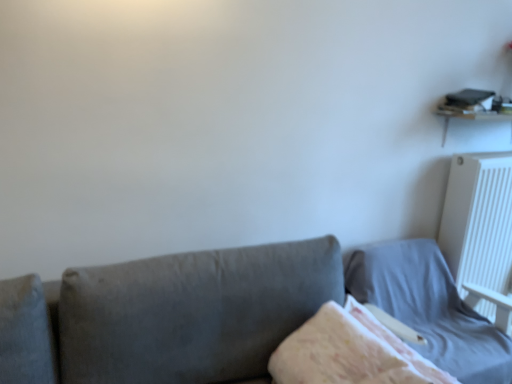
What do you see at coordinates (480, 232) in the screenshot? I see `white plastic radiator at upper right` at bounding box center [480, 232].

Identify the location of fluffy white blanket at center. The image size is (512, 384). (350, 351).

The image size is (512, 384). What do you see at coordinates (429, 307) in the screenshot? I see `light gray fabric bed at lower right` at bounding box center [429, 307].

Locate an element on the screen. This screenshot has height=384, width=512. white plastic radiator at upper right is located at coordinates (480, 232).

Considering the sizes of objects light gray fabric bed at lower right and white plastic radiator at upper right in the image provided, who is smaller, light gray fabric bed at lower right or white plastic radiator at upper right?

white plastic radiator at upper right is smaller.

Does light gray fabric bed at lower right have a lesser width compared to white plastic radiator at upper right?

No.

Which is behind, light gray fabric bed at lower right or white plastic radiator at upper right?

white plastic radiator at upper right is further from the camera.

Which object is thinner, light gray fabric bed at lower right or fluffy white blanket at center?

Thinner between the two is fluffy white blanket at center.

In the image, is light gray fabric bed at lower right on the left side or the right side of fluffy white blanket at center?

Based on their positions, light gray fabric bed at lower right is located to the right of fluffy white blanket at center.

Is light gray fabric bed at lower right positioned beyond the bounds of fluffy white blanket at center?

light gray fabric bed at lower right lies outside fluffy white blanket at center's area.

In the image, there is a light gray fabric bed at lower right. Where is `blanket above it (from the image's perspective)`? blanket above it (from the image's perspective) is located at coordinates (350, 351).

Considering the relative positions of white plastic radiator at upper right and fluffy white blanket at center in the image provided, is white plastic radiator at upper right to the left of fluffy white blanket at center from the viewer's perspective?

Incorrect, white plastic radiator at upper right is not on the left side of fluffy white blanket at center.

Is white plastic radiator at upper right turned away from fluffy white blanket at center?

white plastic radiator at upper right does not have its back to fluffy white blanket at center.

From the image's perspective, which object appears higher, white plastic radiator at upper right or fluffy white blanket at center?

white plastic radiator at upper right appears higher in the image.

Which is less distant, (x=497, y=289) or (x=341, y=326)?

Point (x=497, y=289).

From the picture: Could white plastic radiator at upper right be considered to be inside fluffy white blanket at center?

That's incorrect, white plastic radiator at upper right is not inside fluffy white blanket at center.

Is fluffy white blanket at center directly adjacent to white plastic radiator at upper right?

There is a gap between fluffy white blanket at center and white plastic radiator at upper right.

From a real-world perspective, is fluffy white blanket at center physically below white plastic radiator at upper right?

Yes, from a real-world perspective, fluffy white blanket at center is under white plastic radiator at upper right.

Is fluffy white blanket at center closer to the viewer compared to white plastic radiator at upper right?

That is True.

Is fluffy white blanket at center not within light gray fabric bed at lower right?

Yes, fluffy white blanket at center is located beyond the bounds of light gray fabric bed at lower right.

Which object is further away from the camera, fluffy white blanket at center or light gray fabric bed at lower right?

light gray fabric bed at lower right.

Who is taller, fluffy white blanket at center or light gray fabric bed at lower right?

Standing taller between the two is light gray fabric bed at lower right.

In the scene shown: Can you confirm if fluffy white blanket at center is positioned to the right of light gray fabric bed at lower right?

No, fluffy white blanket at center is not to the right of light gray fabric bed at lower right.

Which of these two, white plastic radiator at upper right or light gray fabric bed at lower right, is wider?

Wider between the two is light gray fabric bed at lower right.

Is white plastic radiator at upper right far away from light gray fabric bed at lower right?

They are positioned close to each other.

Considering the sizes of white plastic radiator at upper right and light gray fabric bed at lower right in the image, is white plastic radiator at upper right bigger or smaller than light gray fabric bed at lower right?

Clearly, white plastic radiator at upper right is smaller in size than light gray fabric bed at lower right.

Where is `radiator that appears above the light gray fabric bed at lower right (from the image's perspective)`? radiator that appears above the light gray fabric bed at lower right (from the image's perspective) is located at coordinates (480, 232).

Image resolution: width=512 pixels, height=384 pixels. In the image, there is a fluffy white blanket at center. Identify the location of bed below it (from the image's perspective). (429, 307).

Which object lies nearer to the anchor point light gray fabric bed at lower right, white plastic radiator at upper right or fluffy white blanket at center?

Based on the image, white plastic radiator at upper right appears to be nearer to light gray fabric bed at lower right.

From the image, which object appears to be nearer to white plastic radiator at upper right, light gray fabric bed at lower right or fluffy white blanket at center?

light gray fabric bed at lower right is positioned closer to the anchor white plastic radiator at upper right.

Considering their positions, is light gray fabric bed at lower right positioned closer to fluffy white blanket at center than white plastic radiator at upper right?

light gray fabric bed at lower right.

Estimate the real-world distances between objects in this image. Which object is further from light gray fabric bed at lower right, fluffy white blanket at center or white plastic radiator at upper right?

The object further to light gray fabric bed at lower right is fluffy white blanket at center.

Based on their spatial positions, is white plastic radiator at upper right or light gray fabric bed at lower right further from fluffy white blanket at center?

white plastic radiator at upper right lies further to fluffy white blanket at center than the other object.

When comparing their distances from white plastic radiator at upper right, does fluffy white blanket at center or light gray fabric bed at lower right seem further?

Among the two, fluffy white blanket at center is located further to white plastic radiator at upper right.

Locate an element on the screen. This screenshot has width=512, height=384. bed between fluffy white blanket at center and white plastic radiator at upper right along the z-axis is located at coordinates (429, 307).